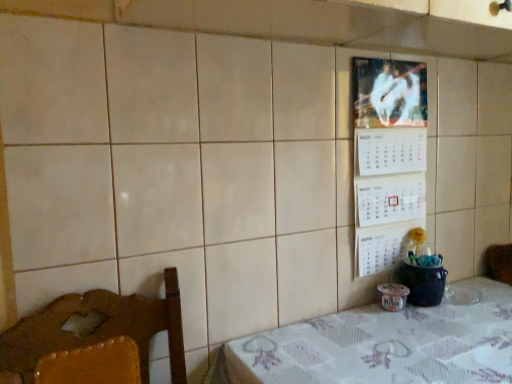
Question: From a real-world perspective, is white paper calendar at upper right positioned above or below white fabric table at lower right?

Choices:
 (A) below
 (B) above

Answer: (B)

Question: In terms of width, does white paper calendar at upper right look wider or thinner when compared to white fabric table at lower right?

Choices:
 (A) wide
 (B) thin

Answer: (B)

Question: Is white paper calendar at upper right inside the boundaries of white fabric table at lower right, or outside?

Choices:
 (A) outside
 (B) inside

Answer: (A)

Question: From the image's perspective, is white fabric table at lower right positioned above or below white paper calendar at upper right?

Choices:
 (A) below
 (B) above

Answer: (A)

Question: From a real-world perspective, is white fabric table at lower right above or below white paper calendar at upper right?

Choices:
 (A) above
 (B) below

Answer: (B)

Question: In terms of height, does white fabric table at lower right look taller or shorter compared to white paper calendar at upper right?

Choices:
 (A) short
 (B) tall

Answer: (A)

Question: Is white fabric table at lower right wider or thinner than white paper calendar at upper right?

Choices:
 (A) wide
 (B) thin

Answer: (A)